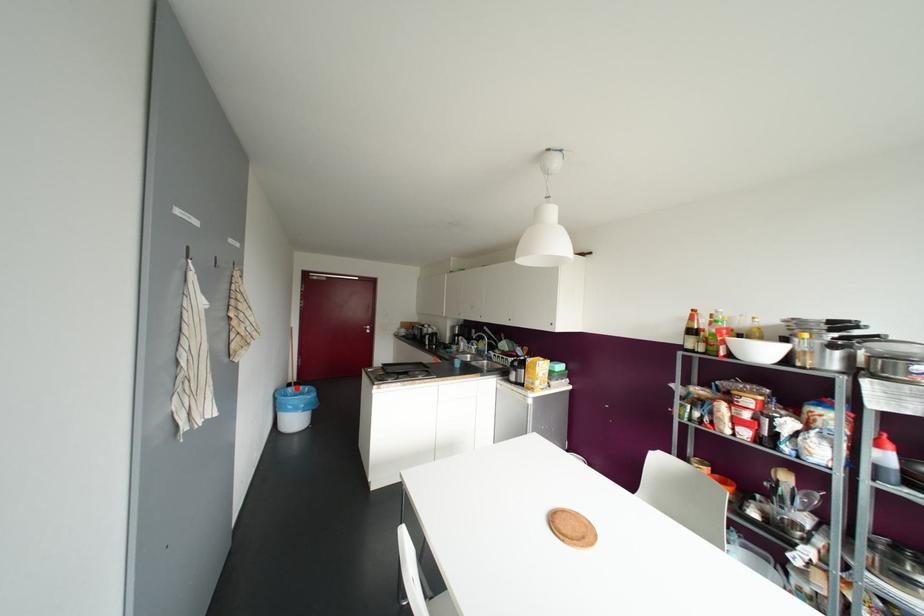
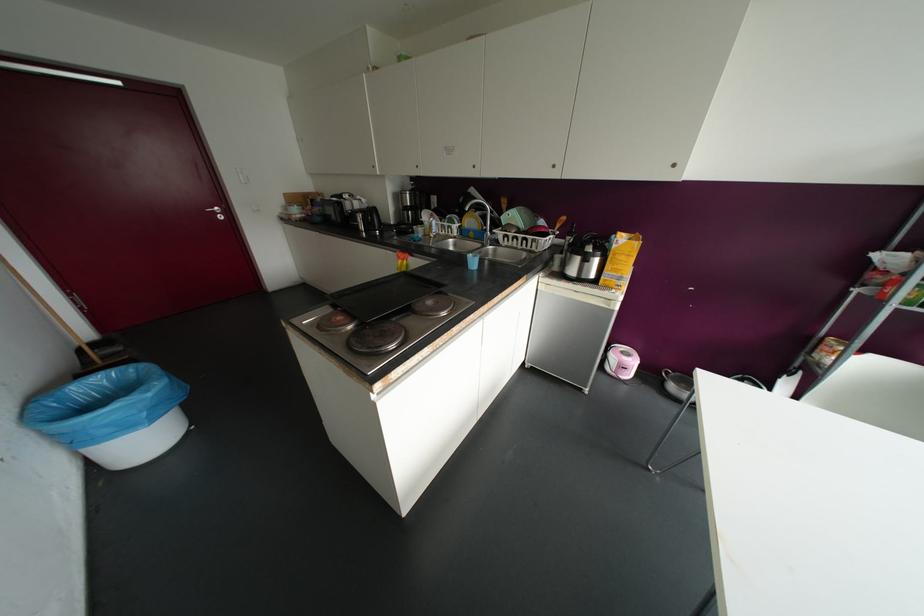
Question: I am providing you with two images of the same scene from different viewpoints. Image1 has a red point marked. In image2, the corresponding 3D location appears at what relative position? Reply with the corresponding letter.

Choices:
 (A) Closer
 (B) Farther

Answer: (A)